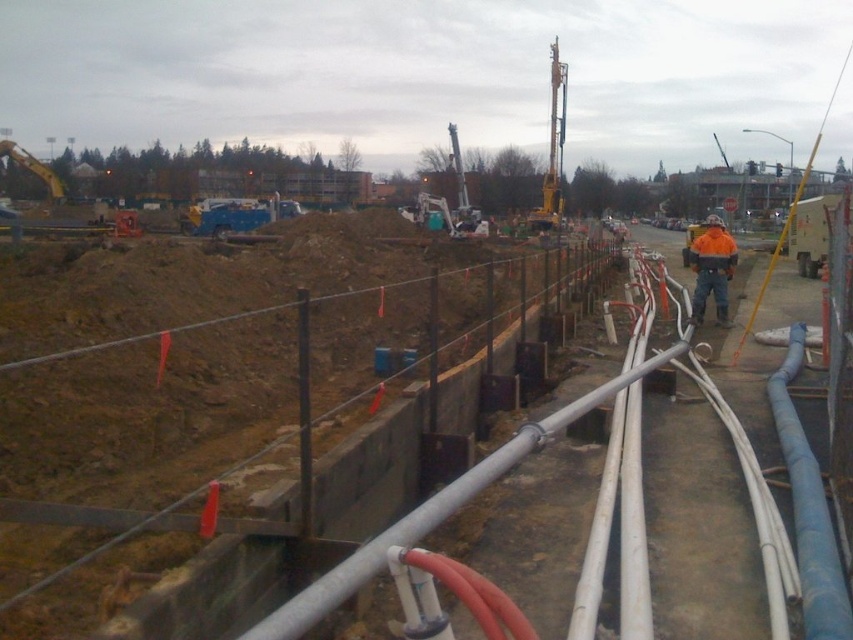
Which is behind, point (207, 579) or point (560, 220)?

The point (560, 220) is more distant.

Looking at this image, does white plastic pipes at center lie in front of yellow metallic drill at upper center?

That is True.

Between point (399, 452) and point (560, 106), which one is positioned in front?

Point (399, 452)

This screenshot has height=640, width=853. I want to click on white plastic pipes at center, so click(637, 572).

Between blue rubber hose at center right and yellow metallic drill at upper center, which one has less height?

blue rubber hose at center right

Does blue rubber hose at center right appear on the left side of yellow metallic drill at upper center?

Yes, blue rubber hose at center right is to the left of yellow metallic drill at upper center.

Is point (790, 419) closer to viewer compared to point (548, 168)?

Yes, it is in front of point (548, 168).

At what (x,y) coordinates should I click in order to perform the action: click on blue rubber hose at center right. Please return your answer as a coordinate pair (x, y). This screenshot has height=640, width=853. Looking at the image, I should click on (809, 509).

Does blue rubber hose at center right lie behind white plastic pipes at center?

Yes, blue rubber hose at center right is behind white plastic pipes at center.

Can you confirm if blue rubber hose at center right is bigger than white plastic pipes at center?

Actually, blue rubber hose at center right might be smaller than white plastic pipes at center.

Which is behind, point (838, 563) or point (627, 508)?

The point (627, 508) is behind.

In order to click on blue rubber hose at center right in this screenshot , I will do `click(809, 509)`.